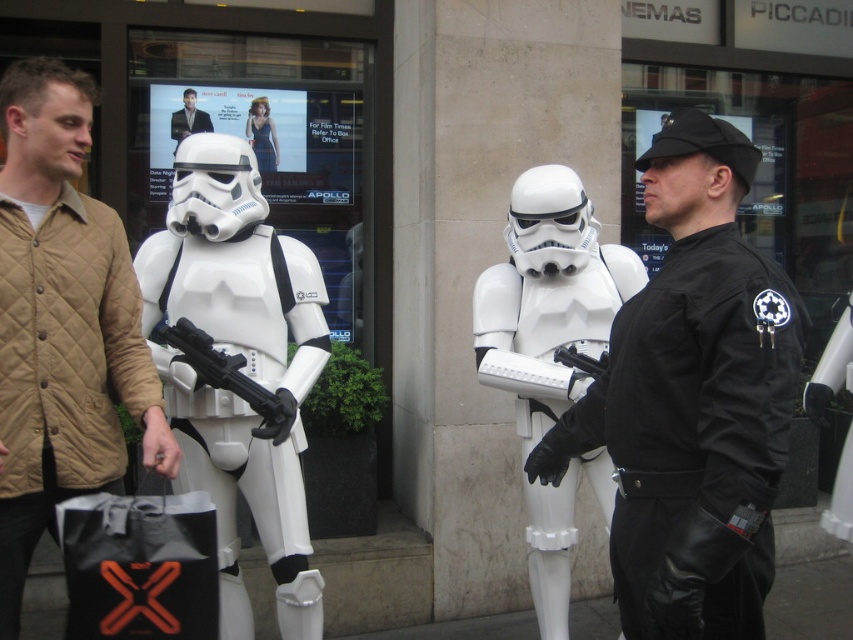
Describe the element at coordinates (692, 401) in the screenshot. I see `black leather jacket at center` at that location.

Is point (653, 429) in front of point (123, 524)?

Yes, point (653, 429) is in front of point (123, 524).

The image size is (853, 640). In order to click on black leather jacket at center in this screenshot , I will do `click(692, 401)`.

Locate an element on the screen. This screenshot has width=853, height=640. black leather jacket at center is located at coordinates (692, 401).

Between black leather jacket at center and white matte stormtrooper at left, which one appears on the right side from the viewer's perspective?

Positioned to the right is black leather jacket at center.

Between black leather jacket at center and white matte stormtrooper at left, which one is positioned lower?

white matte stormtrooper at left

Between point (625, 384) and point (305, 566), which one is positioned behind?

The point (305, 566) is more distant.

Where is `black leather jacket at center`? Image resolution: width=853 pixels, height=640 pixels. black leather jacket at center is located at coordinates (692, 401).

Does black leather jacket at center appear over smooth skin man at upper left?

Incorrect, black leather jacket at center is not positioned above smooth skin man at upper left.

Is the position of black leather jacket at center more distant than that of smooth skin man at upper left?

No, it is not.

Locate an element on the screen. Image resolution: width=853 pixels, height=640 pixels. black leather jacket at center is located at coordinates (692, 401).

In order to click on black leather jacket at center in this screenshot , I will do `click(692, 401)`.